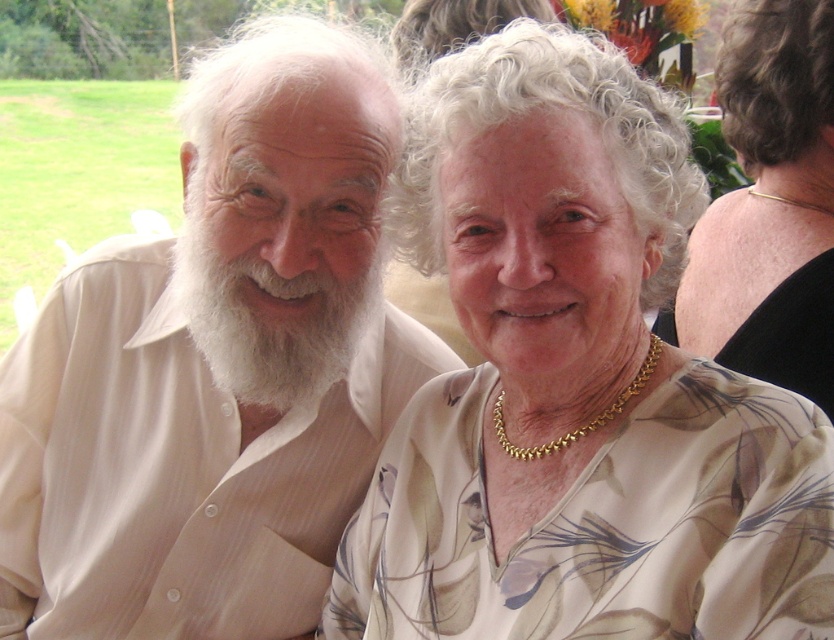
Is white floral blouse at center positioned at the back of light beige shirt at left?

That is False.

Can you confirm if white floral blouse at center is positioned below light beige shirt at left?

Correct, white floral blouse at center is located below light beige shirt at left.

Measure the distance between white floral blouse at center and camera.

white floral blouse at center is 1.45 meters away from camera.

The image size is (834, 640). Identify the location of white floral blouse at center. (575, 385).

How distant is white floral blouse at center from gold necklace at upper right?

They are 25.76 inches apart.

Can you confirm if white floral blouse at center is positioned below gold necklace at upper right?

Indeed, white floral blouse at center is positioned under gold necklace at upper right.

You are a GUI agent. You are given a task and a screenshot of the screen. Output one action in this format:
    pyautogui.click(x=<x>, y=<y>)
    Task: Click on the white floral blouse at center
    Image resolution: width=834 pixels, height=640 pixels.
    Given the screenshot: What is the action you would take?
    pyautogui.click(x=575, y=385)

Find the location of `white floral blouse at center`. white floral blouse at center is located at coordinates pyautogui.click(x=575, y=385).

Which is more to the left, white floral blouse at center or white fluffy beard at left?

From the viewer's perspective, white fluffy beard at left appears more on the left side.

Does white floral blouse at center have a greater width compared to white fluffy beard at left?

Yes.

Find the location of a particular element. This screenshot has height=640, width=834. white floral blouse at center is located at coordinates (575, 385).

At what (x,y) coordinates should I click in order to perform the action: click on white floral blouse at center. Please return your answer as a coordinate pair (x, y). Looking at the image, I should click on (575, 385).